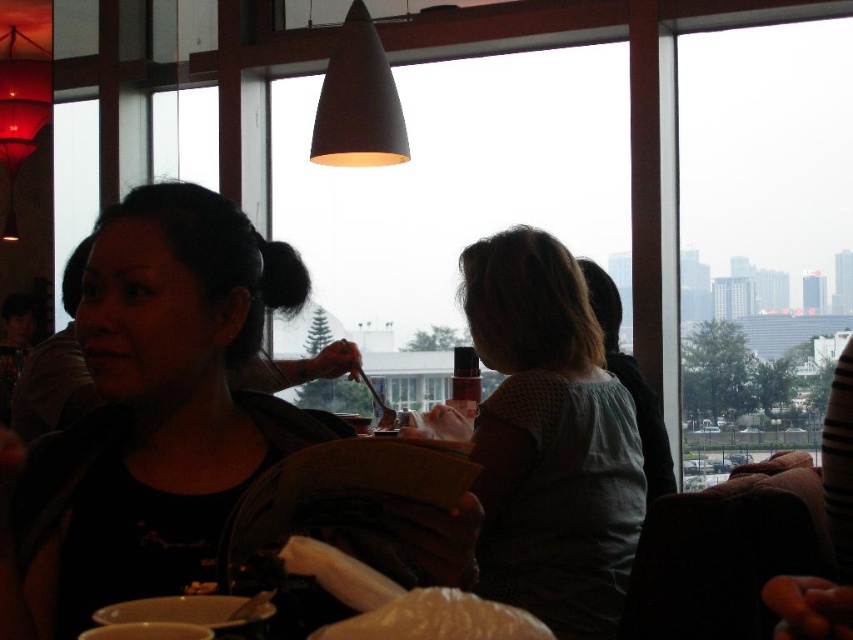
Is matte black shirt at center smaller than light blue cotton shirt at center?

Actually, matte black shirt at center might be larger than light blue cotton shirt at center.

Which of these two, matte black shirt at center or light blue cotton shirt at center, stands shorter?

matte black shirt at center

This screenshot has height=640, width=853. In order to click on matte black shirt at center in this screenshot , I will do `click(149, 413)`.

Is matte black shirt at center thinner than white fluffy bread at center?

No, matte black shirt at center is not thinner than white fluffy bread at center.

Does matte black shirt at center appear on the right side of white fluffy bread at center?

No, matte black shirt at center is not to the right of white fluffy bread at center.

Where is `matte black shirt at center`? The image size is (853, 640). matte black shirt at center is located at coordinates (149, 413).

Describe the element at coordinates (761, 237) in the screenshot. The height and width of the screenshot is (640, 853). I see `transparent glass window at upper right` at that location.

Is transparent glass window at upper right taller than white fluffy bread at center?

Yes.

Who is more distant from viewer, (795, 314) or (520, 618)?

Point (795, 314)

The height and width of the screenshot is (640, 853). In order to click on transparent glass window at upper right in this screenshot , I will do `click(761, 237)`.